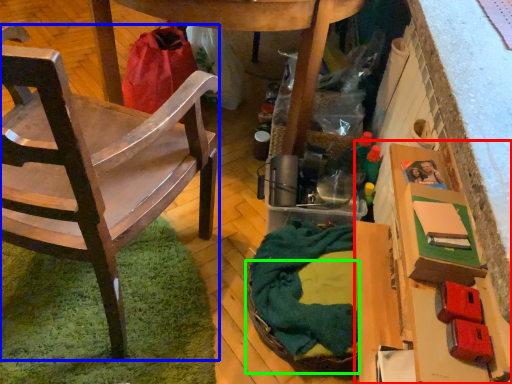
Question: Which object is positioned closest to cardboard box (highlighted by a red box)? Select from chair (highlighted by a blue box) and basket (highlighted by a green box).

Choices:
 (A) chair
 (B) basket

Answer: (B)